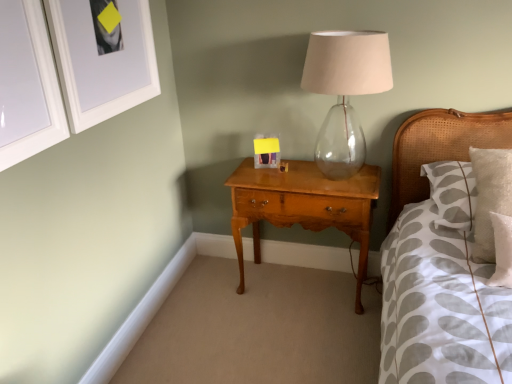
Question: From a real-world perspective, is matte plastic picture frame at center, placed as the third picture frame when sorted from left to right, physically located above or below woven cane headboard at right?

Choices:
 (A) above
 (B) below

Answer: (B)

Question: Would you say matte plastic picture frame at center, marked as the 3th picture frame in a front-to-back arrangement, is inside or outside woven cane headboard at right?

Choices:
 (A) outside
 (B) inside

Answer: (A)

Question: Based on their relative distances, which object is farther from the transparent glass table lamp at center?

Choices:
 (A) woven cane headboard at right
 (B) white glossy picture frame at upper left, the third picture frame when ordered from back to front
 (C) shiny brown wood nightstand at center
 (D) white matte picture frame at upper left, the second picture frame from the back
 (E) matte plastic picture frame at center, marked as the 1th picture frame in a back-to-front arrangement

Answer: (B)

Question: Based on their relative distances, which object is farther from the shiny brown wood nightstand at center?

Choices:
 (A) woven cane headboard at right
 (B) matte plastic picture frame at center, placed as the third picture frame when sorted from left to right
 (C) white matte picture frame at upper left, the second picture frame from the back
 (D) white glossy picture frame at upper left, which ranks as the 1th picture frame in left-to-right order
 (E) transparent glass table lamp at center

Answer: (D)